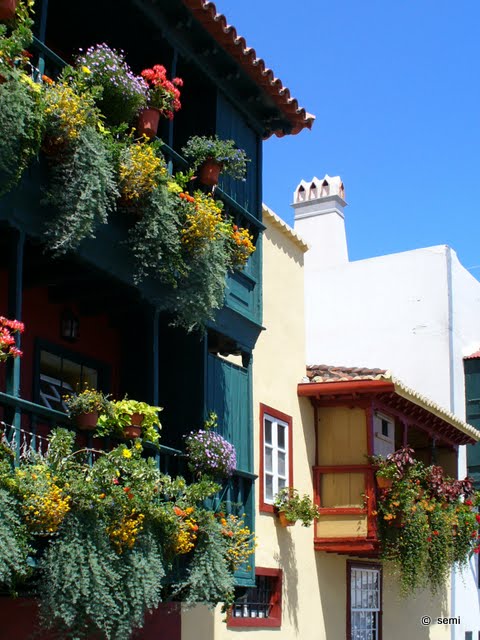
Identify the location of pot. (150, 113), (211, 172), (79, 417), (137, 428), (385, 479), (283, 515).